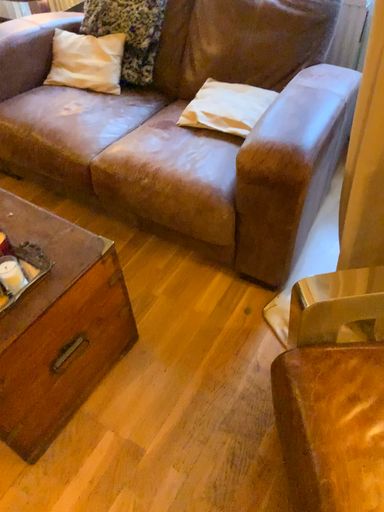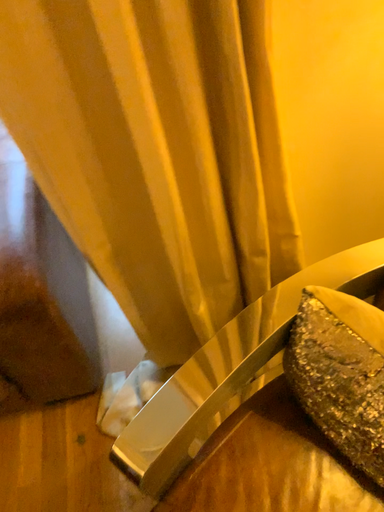
Question: How did the camera likely rotate when shooting the video?

Choices:
 (A) rotated downward
 (B) rotated upward

Answer: (B)